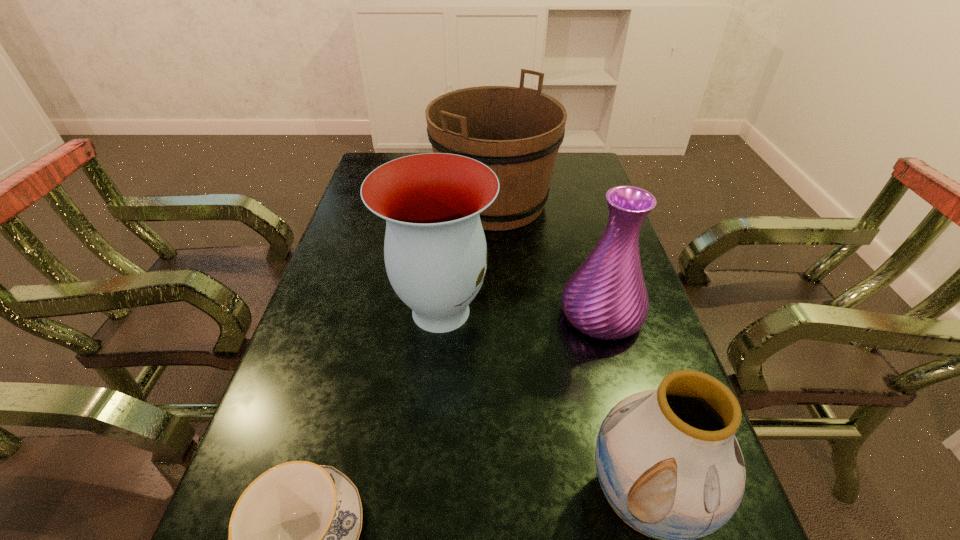
At what (x,y) coordinates should I click in order to perform the action: click on bucket. Please return your answer as a coordinate pair (x, y). Looking at the image, I should click on (516, 131).

Image resolution: width=960 pixels, height=540 pixels. Identify the location of the leftmost vase. coord(435,252).

You are a GUI agent. You are given a task and a screenshot of the screen. Output one action in this format:
    pyautogui.click(x=<x>, y=<y>)
    Task: Click on the vacant space located 0.140m on the left of the bucket
    The height and width of the screenshot is (540, 960).
    Given the screenshot: What is the action you would take?
    pyautogui.click(x=390, y=202)

Locate an element on the screen. This screenshot has height=540, width=960. free location located 0.360m on the front of the leftmost vase is located at coordinates (421, 532).

Image resolution: width=960 pixels, height=540 pixels. Identify the location of object present at the far edge. (516, 131).

Where is `object at the right edge`? This screenshot has width=960, height=540. object at the right edge is located at coordinates (606, 298).

Find the location of a particular element. This screenshot has width=960, height=540. vacant space at the left edge of the desktop is located at coordinates (313, 303).

Where is `vacant space at the right edge`? vacant space at the right edge is located at coordinates (574, 249).

Locate an element on the screen. vacant space at the far right corner is located at coordinates (583, 156).

Select which object is the closest to the leftmost vase. Please provide its 2D coordinates. Your answer should be formatted as a tuple, i.e. [(x, y)], where the tuple contains the x and y coordinates of a point satisfying the conditions above.

[(606, 298)]